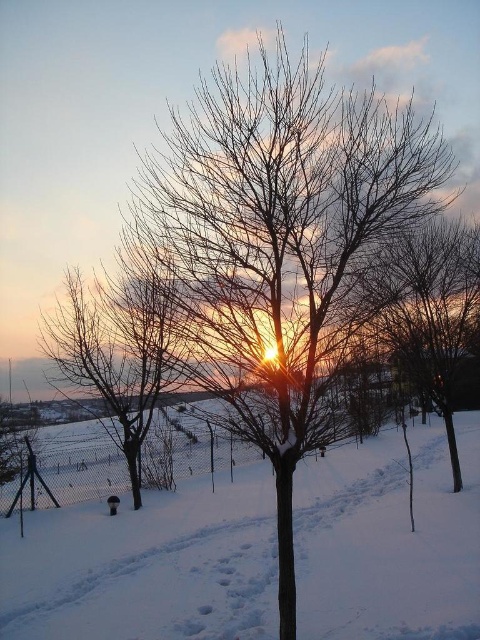
Looking at this image, is white powdery snow at center above bare branches at center?

No.

Who is more distant from viewer, (x=456, y=595) or (x=130, y=292)?

Point (x=130, y=292)

This screenshot has width=480, height=640. Describe the element at coordinates (146, 566) in the screenshot. I see `white powdery snow at center` at that location.

What are the coordinates of `white powdery snow at center` in the screenshot? It's located at (146, 566).

Which is behind, point (423, 125) or point (80, 390)?

Point (80, 390)

Which is below, brown/dry wood tree at center or bare branches at center?

bare branches at center is below.

Is point (409, 193) positioned in front of point (157, 333)?

Yes, point (409, 193) is in front of point (157, 333).

Identify the location of brown/dry wood tree at center. This screenshot has width=480, height=640. (276, 244).

Between brown/dry wood tree at center and white powdery snow at center, which one has less height?

white powdery snow at center is shorter.

Which is above, brown/dry wood tree at center or white powdery snow at center?

brown/dry wood tree at center

Identify the location of brown/dry wood tree at center. This screenshot has width=480, height=640. (276, 244).

This screenshot has height=640, width=480. I want to click on brown/dry wood tree at center, so click(276, 244).